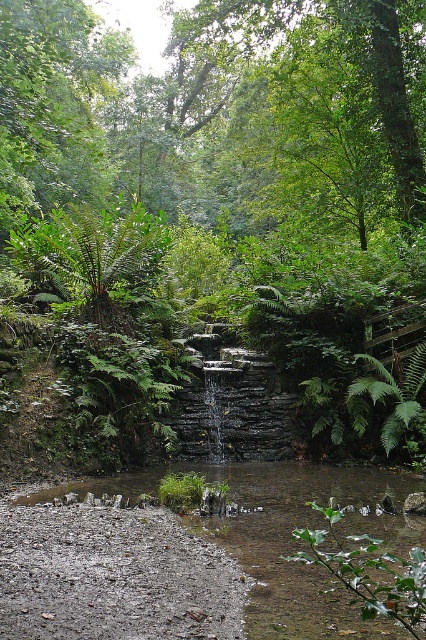
Consider the image. You are standing at the point labeled point (x=362, y=532). You need to reach a destination that is 6.10 meters away from your current position. Is there enough space to walk in a straight line to your destination without any obstacles?

Yes, there is enough space to walk in a straight line to the destination 6.10 meters away from point (x=362, y=532) because the scene describes a rocky path leading towards the waterfall with clear water flowing over stones, indicating an open path. The dense vegetation is in the middle and background, so the immediate area around the point is likely obstacle free.